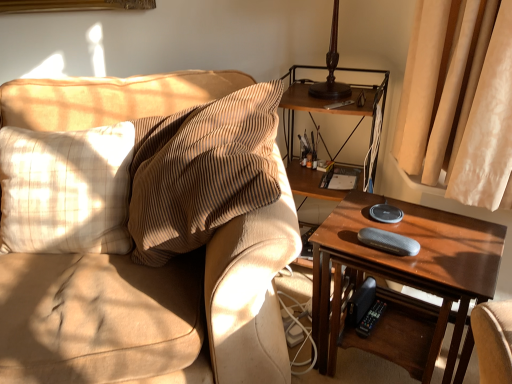
Where is `empty space that is ontop of wooden table at right (from a real-world perspective)`? The height and width of the screenshot is (384, 512). empty space that is ontop of wooden table at right (from a real-world perspective) is located at coordinates (412, 233).